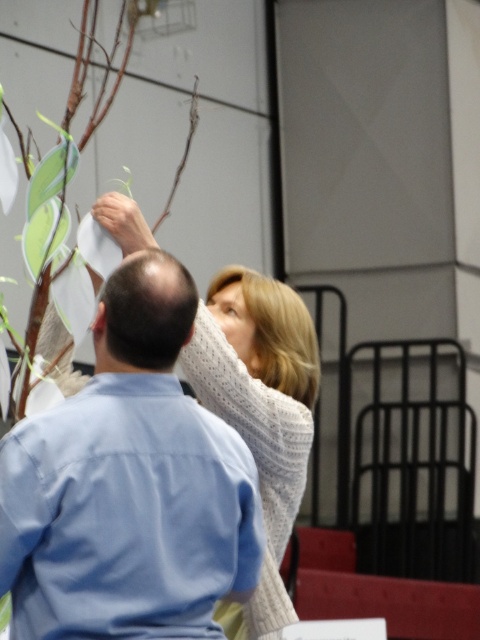
Question: Which point appears farthest from the camera in this image?

Choices:
 (A) (x=171, y=195)
 (B) (x=58, y=422)

Answer: (A)

Question: Does blue cotton shirt at upper left come behind brown matte branch at upper center?

Choices:
 (A) no
 (B) yes

Answer: (A)

Question: Which point appears farthest from the camera in this image?

Choices:
 (A) (168, 202)
 (B) (118, 371)

Answer: (A)

Question: Can you confirm if blue cotton shirt at upper left is thinner than brown matte branch at upper center?

Choices:
 (A) no
 (B) yes

Answer: (A)

Question: In this image, where is blue cotton shirt at upper left located relative to brown matte branch at upper center?

Choices:
 (A) left
 (B) right

Answer: (A)